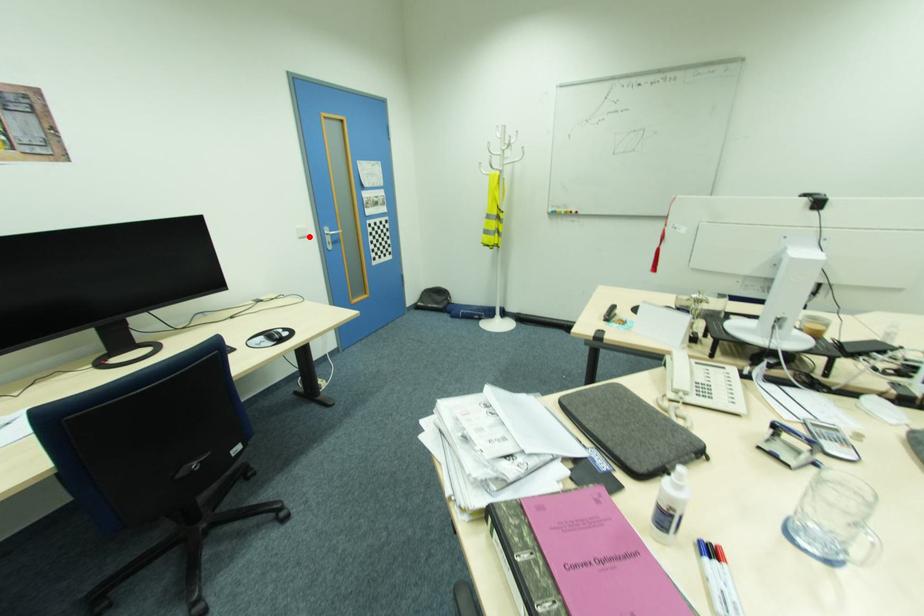
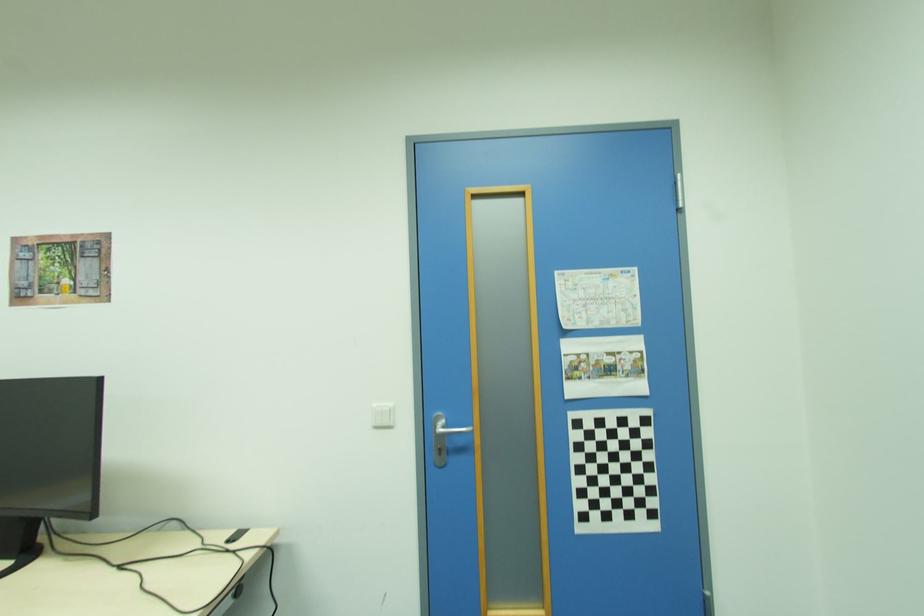
Question: I am providing you with two images of the same scene from different viewpoints. Image1 has a red point marked. In image2, the corresponding 3D location appears at what relative position? Reply with the corresponding letter.

Choices:
 (A) Closer
 (B) Farther

Answer: (B)